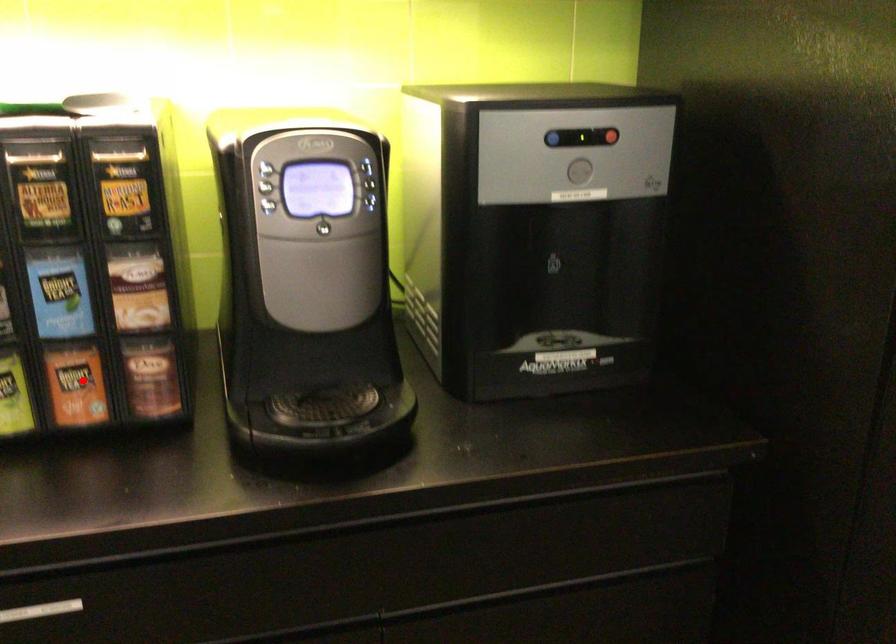
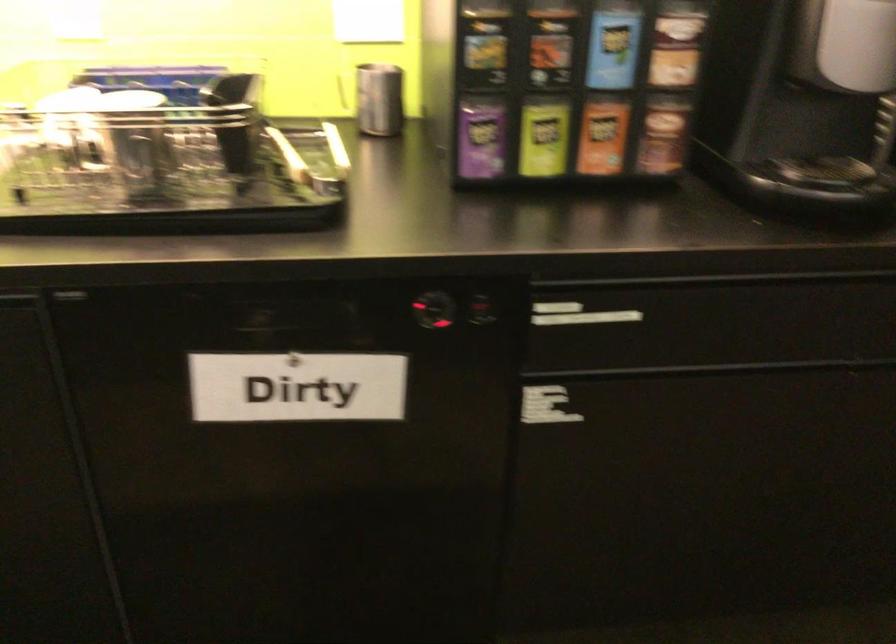
Locate, in the second image, the point that corresponds to the highlighted location in the first image.

(602, 136)